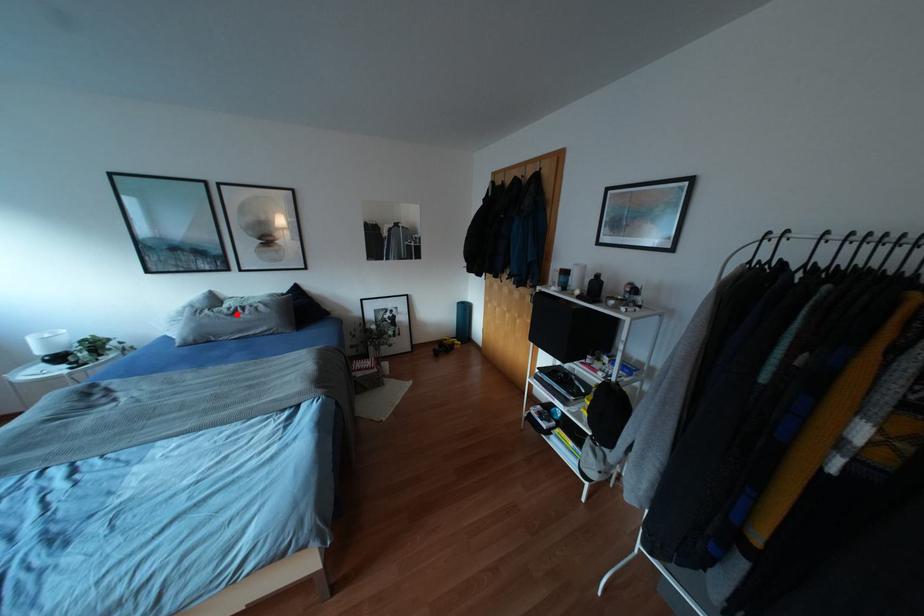
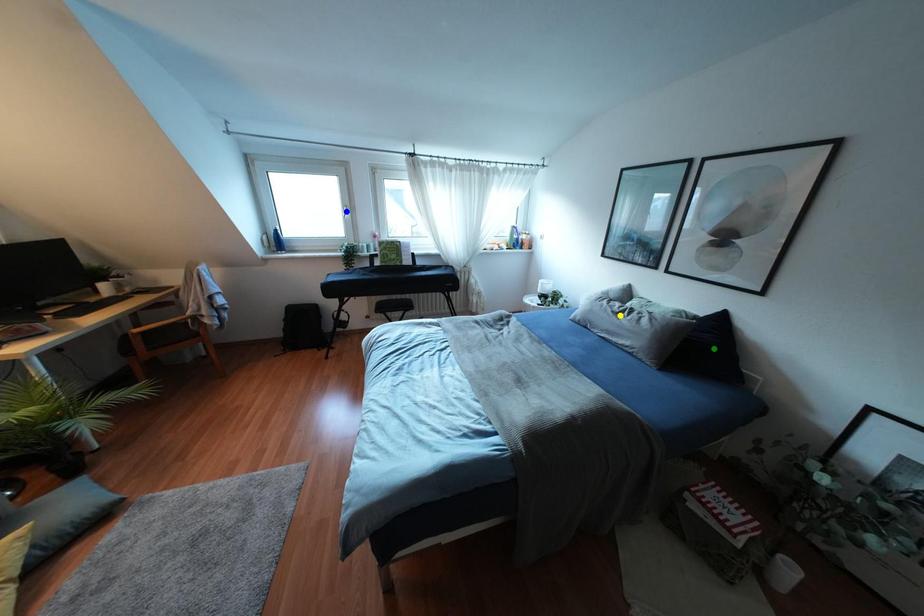
Question: I am providing you with two images of the same scene from different viewpoints. A red point is marked on the first image. You are given multiple points on the second image. Which mark in image 2 goes with the point in image 1?

Choices:
 (A) green point
 (B) blue point
 (C) yellow point

Answer: (C)